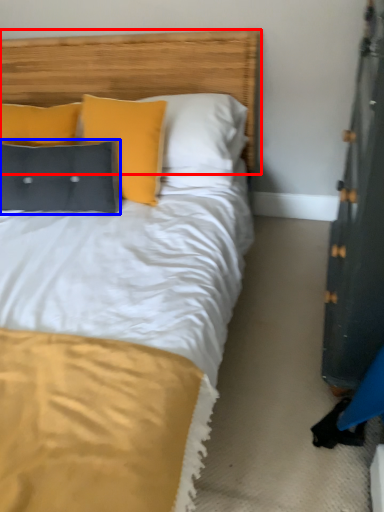
Question: Which point is further to the camera, headboard (highlighted by a red box) or pillow (highlighted by a blue box)?

Choices:
 (A) headboard
 (B) pillow

Answer: (B)